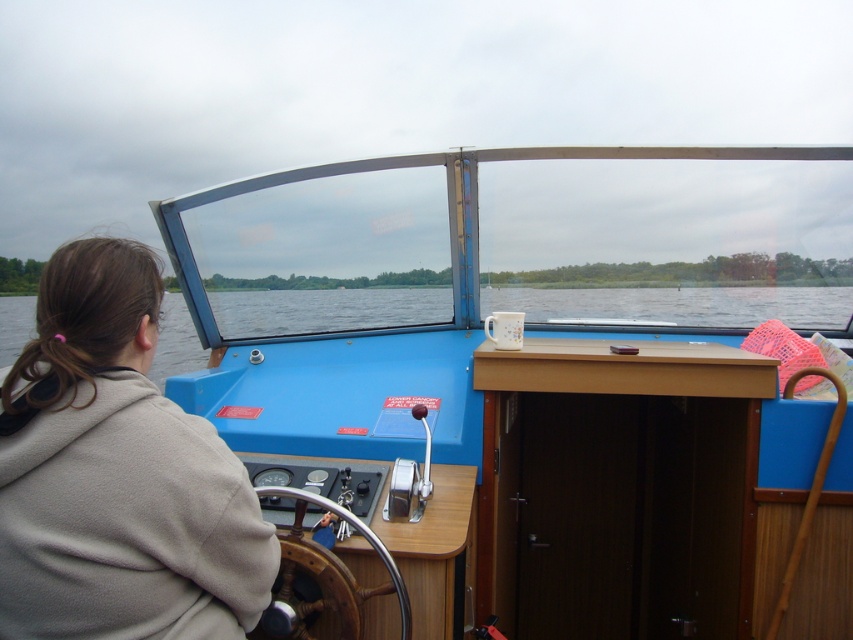
You are a passenger on the boat and need to place a smartphone on the table next to the transparent glass water at center. Can the beige fleece jacket at lower left fit on the table as well without overlapping the smartphone and the glass?

The beige fleece jacket at lower left is narrower than the transparent glass water at center, so it can fit on the table alongside the smartphone and the glass without overlapping them.

You are a passenger on the boat and need to place a small item on the surface closest to you. Which object, the beige fleece jacket at lower left or the transparent glass water at center, is taller and thus might require more space?

The beige fleece jacket at lower left is taller than the transparent glass water at center, so it might require more vertical space.